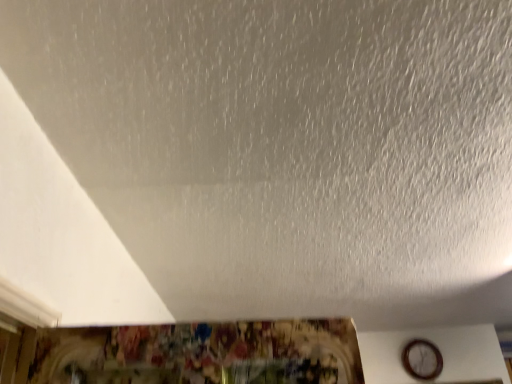
The image size is (512, 384). Describe the element at coordinates (422, 359) in the screenshot. I see `wooden clock at lower right` at that location.

I want to click on wooden clock at lower right, so click(422, 359).

Find the location of `wooden clock at lower right`. wooden clock at lower right is located at coordinates [x=422, y=359].